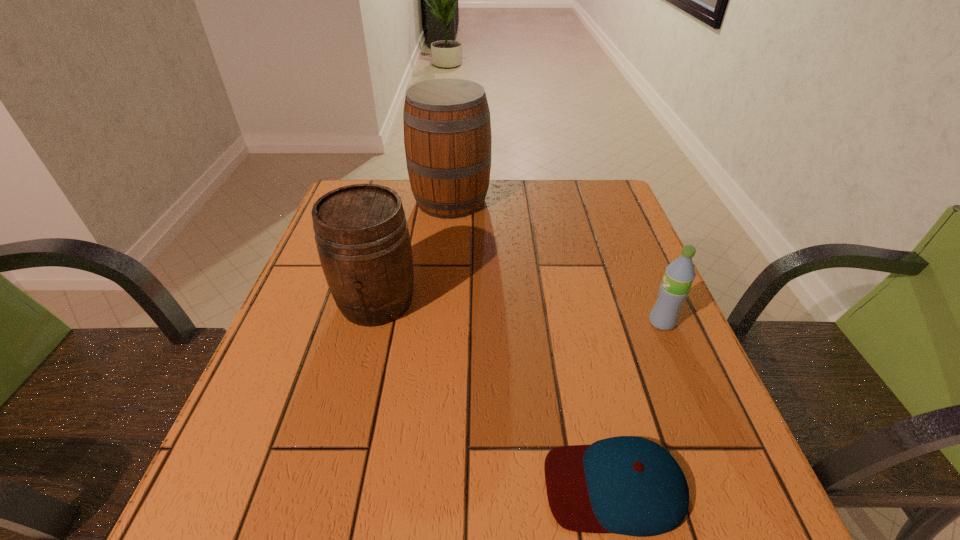
Where is `the taller cider`? the taller cider is located at coordinates (447, 129).

The height and width of the screenshot is (540, 960). I want to click on the farther cider, so click(447, 129).

I want to click on the shorter cider, so click(361, 232).

The width and height of the screenshot is (960, 540). What are the coordinates of `the third shortest object` in the screenshot? It's located at (361, 232).

The width and height of the screenshot is (960, 540). Identify the location of the rightmost object. (679, 275).

Locate an element on the screen. The image size is (960, 540). water bottle is located at coordinates (679, 275).

This screenshot has height=540, width=960. In order to click on the nearest object in this screenshot , I will do `click(628, 485)`.

Where is `baseball cap`? The height and width of the screenshot is (540, 960). baseball cap is located at coordinates (628, 485).

Identify the location of blank area located 0.290m on the right of the farthest object. (590, 200).

Identify the location of vacant region located 0.320m on the side of the nearer cider near the bung hole. (327, 495).